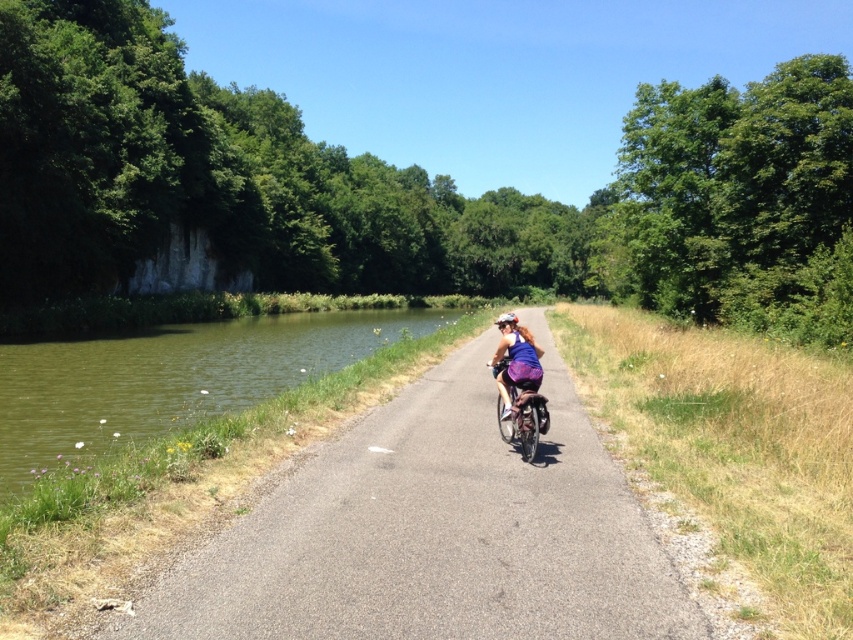
Question: Which point is closer to the camera?

Choices:
 (A) green grassy river at left
 (B) asphalt road at center
 (C) purple fabric helmet at center

Answer: (B)

Question: Is asphalt road at center to the left of purple fabric helmet at center from the viewer's perspective?

Choices:
 (A) yes
 (B) no

Answer: (A)

Question: Which point appears farthest from the camera in this image?

Choices:
 (A) (535, 464)
 (B) (512, 406)
 (C) (4, 419)
 (D) (508, 362)

Answer: (C)

Question: Does green grassy river at left have a smaller size compared to metallic silver bicycle at center?

Choices:
 (A) no
 (B) yes

Answer: (A)

Question: Can you confirm if asphalt road at center is wider than purple fabric helmet at center?

Choices:
 (A) yes
 (B) no

Answer: (A)

Question: Which point is farther to the camera?

Choices:
 (A) (498, 342)
 (B) (531, 380)

Answer: (A)